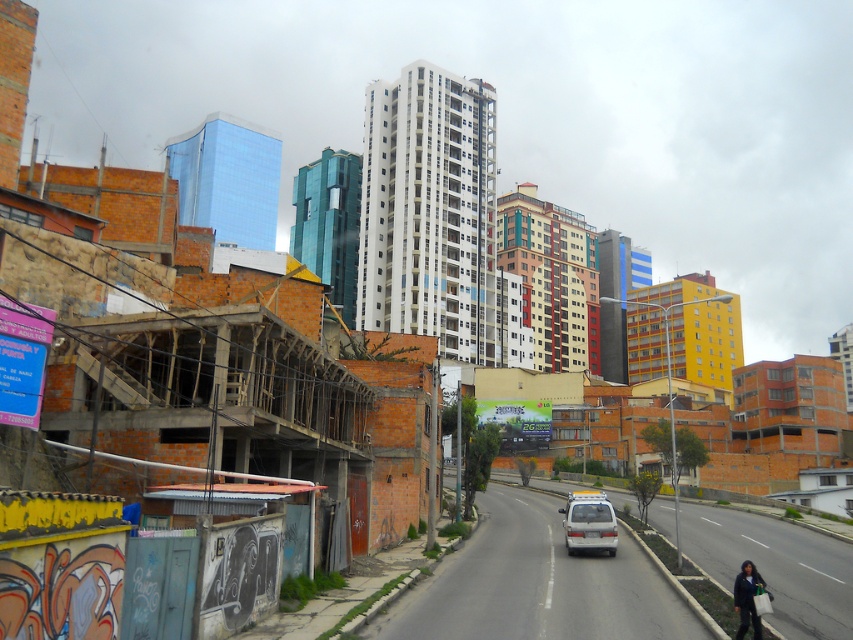
Is point (612, 538) closer to camera compared to point (740, 586)?

That is False.

Between point (593, 500) and point (738, 609), which one is positioned in front?

Positioned in front is point (738, 609).

At what (x,y) coordinates should I click in order to perform the action: click on white matte van at center. Please return your answer as a coordinate pair (x, y). The width and height of the screenshot is (853, 640). Looking at the image, I should click on (589, 522).

In order to click on gray asphalt road at center in this screenshot , I will do `click(537, 584)`.

Is the position of gray asphalt road at center less distant than that of white matte van at center?

Yes.

Does point (503, 598) come farther from viewer compared to point (589, 496)?

No, it is not.

The height and width of the screenshot is (640, 853). Find the location of `gray asphalt road at center`. gray asphalt road at center is located at coordinates (537, 584).

Does gray asphalt road at center have a larger size compared to dark blue jacket at lower right?

Yes.

Does gray asphalt road at center have a lesser height compared to dark blue jacket at lower right?

Incorrect, gray asphalt road at center's height does not fall short of dark blue jacket at lower right's.

Who is more forward, [576,588] or [750,564]?

Positioned in front is point [750,564].

Where is `gray asphalt road at center`? Image resolution: width=853 pixels, height=640 pixels. gray asphalt road at center is located at coordinates (537, 584).